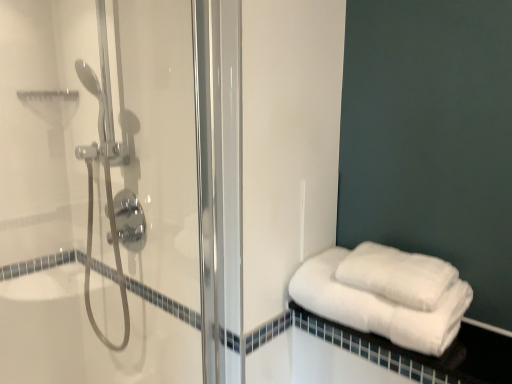
Question: From a real-world perspective, is white cotton towels at lower right positioned above or below white fluffy towels at lower right, which is the second towel from bottom to top?

Choices:
 (A) below
 (B) above

Answer: (A)

Question: Based on their positions, is white cotton towels at lower right located to the left or right of white fluffy towels at lower right, the 1th towel from the top?

Choices:
 (A) right
 (B) left

Answer: (A)

Question: Based on their relative distances, which object is farther from the white fluffy towels at right, the first towel in the bottom-to-top sequence?

Choices:
 (A) clear glass shower door at left
 (B) white fluffy towels at lower right, the 1th towel from the top
 (C) white cotton towels at lower right

Answer: (A)

Question: Which of these objects is positioned farthest from the white cotton towels at lower right?

Choices:
 (A) white fluffy towels at right, the first towel in the bottom-to-top sequence
 (B) clear glass shower door at left
 (C) white fluffy towels at lower right, which is the second towel from bottom to top

Answer: (B)